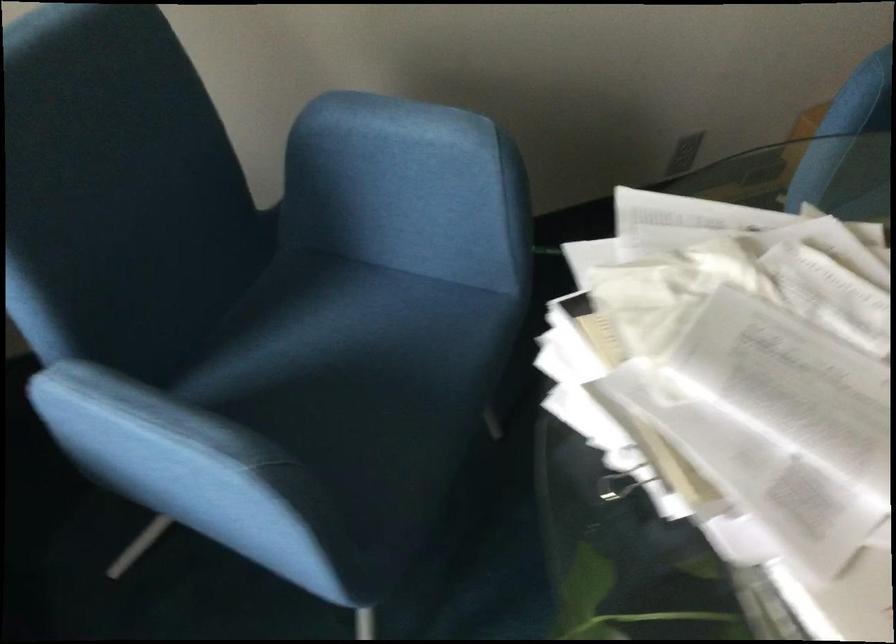
Describe the element at coordinates (682, 158) in the screenshot. I see `a wall electrical outlet` at that location.